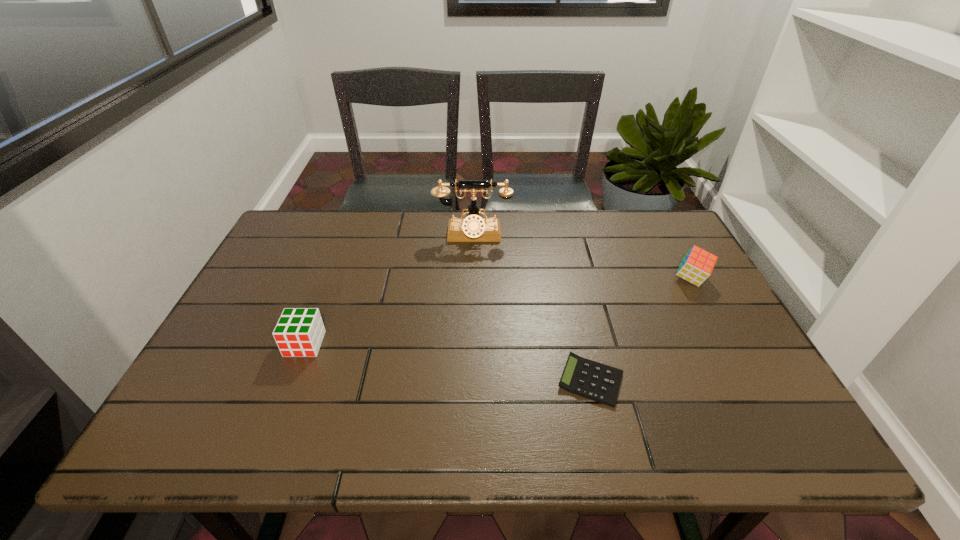
Where is `empty space that is in between the second object from left to right and the farther cube`? This screenshot has height=540, width=960. empty space that is in between the second object from left to right and the farther cube is located at coordinates (582, 257).

Locate an element on the screen. This screenshot has height=540, width=960. vacant point located between the second shortest object and the second object from right to left is located at coordinates (448, 362).

Image resolution: width=960 pixels, height=540 pixels. What are the coordinates of `empty space between the second shortest object and the calculator` in the screenshot? It's located at [x=448, y=362].

At what (x,y) coordinates should I click in order to perform the action: click on vacant space in between the right cube and the second shortest object. Please return your answer as a coordinate pair (x, y). The height and width of the screenshot is (540, 960). Looking at the image, I should click on (x=498, y=312).

This screenshot has height=540, width=960. What are the coordinates of `free space between the leftmost object and the rightmost object` in the screenshot? It's located at (498, 312).

Locate an element on the screen. This screenshot has width=960, height=540. free space between the calculator and the tallest object is located at coordinates (532, 308).

Image resolution: width=960 pixels, height=540 pixels. Identify the location of vacant region between the second object from right to left and the left cube. (448, 362).

Locate an element on the screen. The image size is (960, 540). blank region between the rightmost object and the tallest object is located at coordinates (582, 257).

Where is `vacant space that is in between the tallest object and the left cube`? This screenshot has height=540, width=960. vacant space that is in between the tallest object and the left cube is located at coordinates (389, 289).

Locate an element on the screen. This screenshot has width=960, height=540. the closest object relative to the rightmost object is located at coordinates (x=589, y=379).